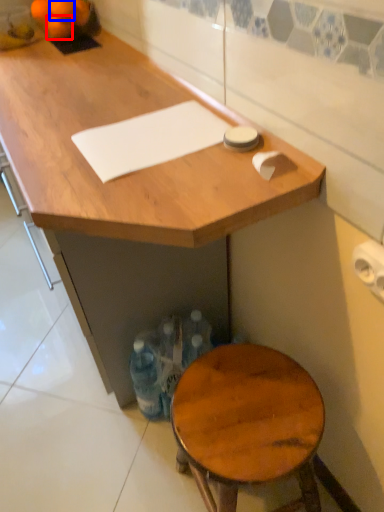
Question: Among these objects, which one is farthest to the camera, tangerine (highlighted by a red box) or tangerine (highlighted by a blue box)?

Choices:
 (A) tangerine
 (B) tangerine

Answer: (A)